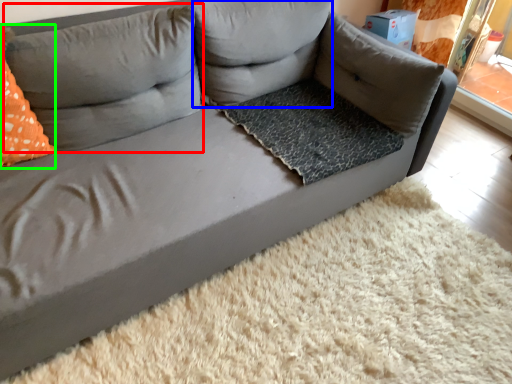
Question: Which object is the farthest from pillow (highlighted by a red box)? Choose among these: pillow (highlighted by a blue box) or throw pillow (highlighted by a green box).

Choices:
 (A) pillow
 (B) throw pillow

Answer: (A)